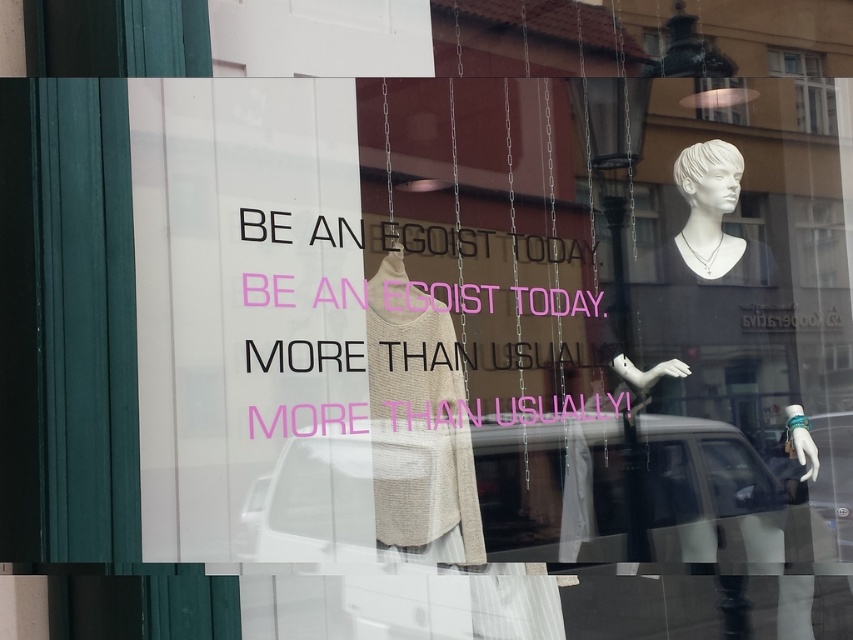
Consider the image. You are standing in front of the storefront window display. There is a point at coordinates point [683,164]. Can you reach this point with your hand if you are 1.7 meters tall?

The point [683,164] is 3.39 meters away from the viewer. Since the distance is greater than your height of 1.7 meters, you cannot reach it with your hand.

You are a customer standing in front of the storefront window. You want to take a closer look at the white porcelain bust at upper right and the transparent glass at upper center. Which object would you need to move closer to first?

You would need to move closer to the white porcelain bust at upper right first because it is closer to the viewer than the transparent glass at upper center.